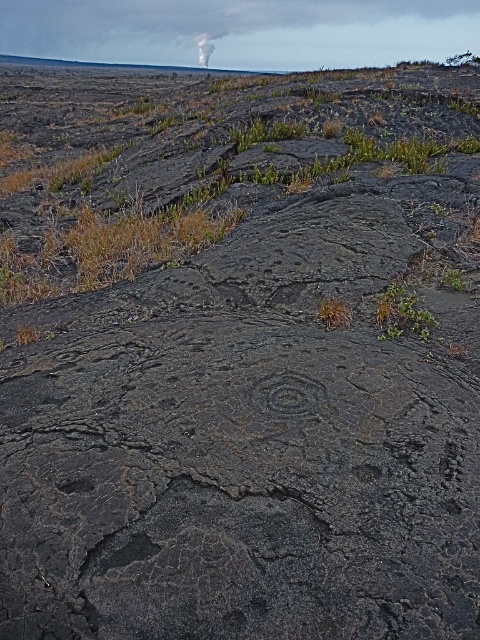
Question: Which of the following is the farthest from the observer?

Choices:
 (A) black textured rock at center
 (B) green leafy plant at center
 (C) white smoke at upper center

Answer: (C)

Question: Is the position of black textured rock at center more distant than that of white smoke at upper center?

Choices:
 (A) no
 (B) yes

Answer: (A)

Question: Which of the following is the closest to the observer?

Choices:
 (A) black textured rock at center
 (B) white smoke at upper center

Answer: (A)

Question: Does green leafy plant at center have a greater width compared to white smoke at upper center?

Choices:
 (A) no
 (B) yes

Answer: (A)

Question: From the image, what is the correct spatial relationship of black textured rock at center in relation to white smoke at upper center?

Choices:
 (A) left
 (B) right

Answer: (B)

Question: Among these points, which one is farthest from the camera?

Choices:
 (A) (410, 316)
 (B) (288, 410)

Answer: (A)